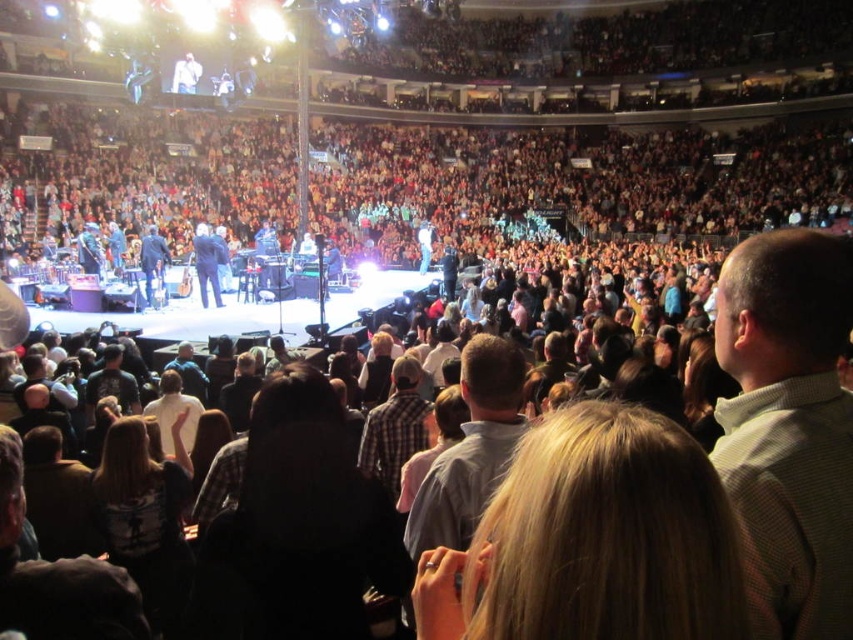
Question: Among these objects, which one is nearest to the camera?

Choices:
 (A) white cotton shirt at center
 (B) blonde hair at center
 (C) light brown checkered shirt at center

Answer: (B)

Question: Which of these objects is positioned farthest from the light brown checkered shirt at center?

Choices:
 (A) white cotton shirt at center
 (B) blonde hair at center

Answer: (A)

Question: Among these points, which one is farthest from the camera?

Choices:
 (A) (160, 420)
 (B) (428, 602)
 (C) (840, 275)

Answer: (A)

Question: Can you confirm if light brown checkered shirt at center is smaller than white cotton shirt at center?

Choices:
 (A) yes
 (B) no

Answer: (B)

Question: Can you confirm if light brown checkered shirt at center is positioned below white cotton shirt at center?

Choices:
 (A) yes
 (B) no

Answer: (B)

Question: Can you confirm if blonde hair at center is positioned to the left of light brown checkered shirt at center?

Choices:
 (A) yes
 (B) no

Answer: (A)